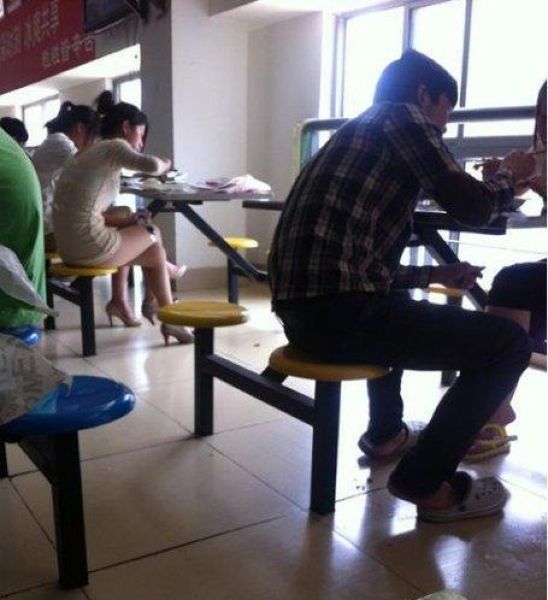
The width and height of the screenshot is (548, 600). In order to click on wall in this screenshot , I will do `click(218, 92)`.